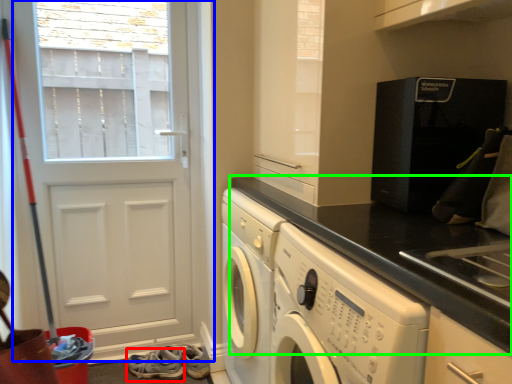
Question: Estimate the real-world distances between objects in this image. Which object is farther from shoe (highlighted by a red box), door (highlighted by a blue box) or countertop (highlighted by a green box)?

Choices:
 (A) door
 (B) countertop

Answer: (B)